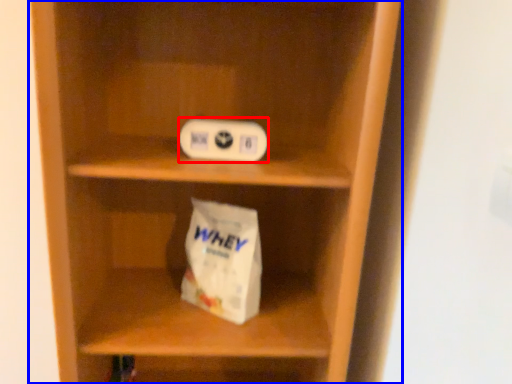
Question: Which point is closer to the camera, ipod (highlighted by a red box) or shelf (highlighted by a blue box)?

Choices:
 (A) ipod
 (B) shelf

Answer: (B)